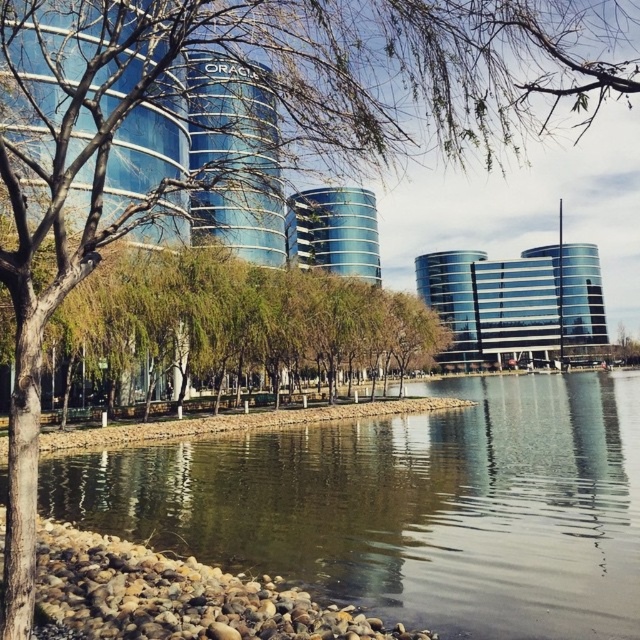
Question: In this image, where is green reflective water at center located relative to smooth stone water at lower center?

Choices:
 (A) above
 (B) below

Answer: (A)

Question: Which point is farther to the camera?

Choices:
 (A) (573, 595)
 (B) (52, 452)

Answer: (B)

Question: Which of the following is the closest to the observer?

Choices:
 (A) smooth stone water at lower center
 (B) green reflective water at center

Answer: (B)

Question: Among these objects, which one is nearest to the camera?

Choices:
 (A) green reflective water at center
 (B) smooth stone water at lower center

Answer: (A)

Question: Does green reflective water at center have a greater width compared to smooth stone water at lower center?

Choices:
 (A) no
 (B) yes

Answer: (B)

Question: Is green reflective water at center wider than smooth stone water at lower center?

Choices:
 (A) yes
 (B) no

Answer: (A)